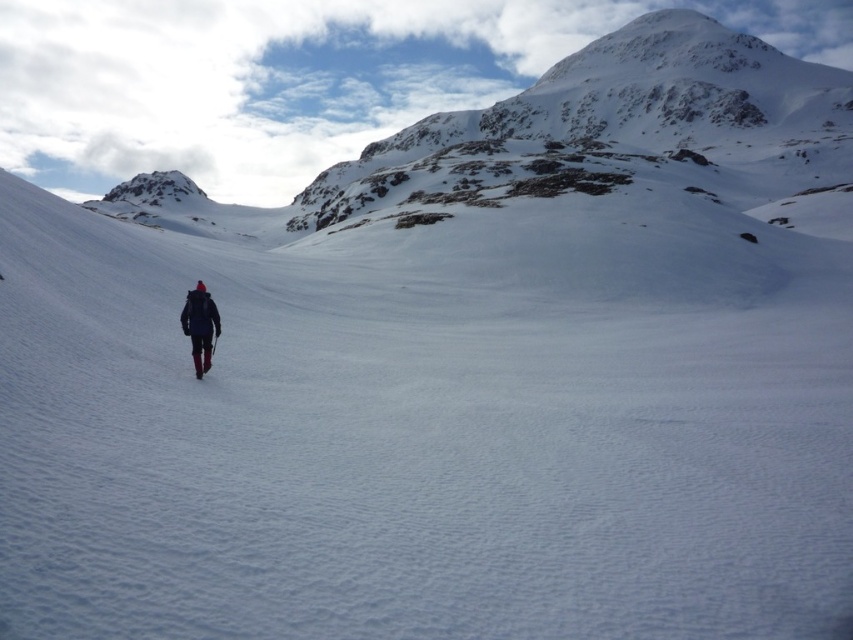
Is dark blue fabric jacket at center shorter than matte black ski at center?

No, dark blue fabric jacket at center is not shorter than matte black ski at center.

Find the location of `dark blue fabric jacket at center`. dark blue fabric jacket at center is located at coordinates (200, 324).